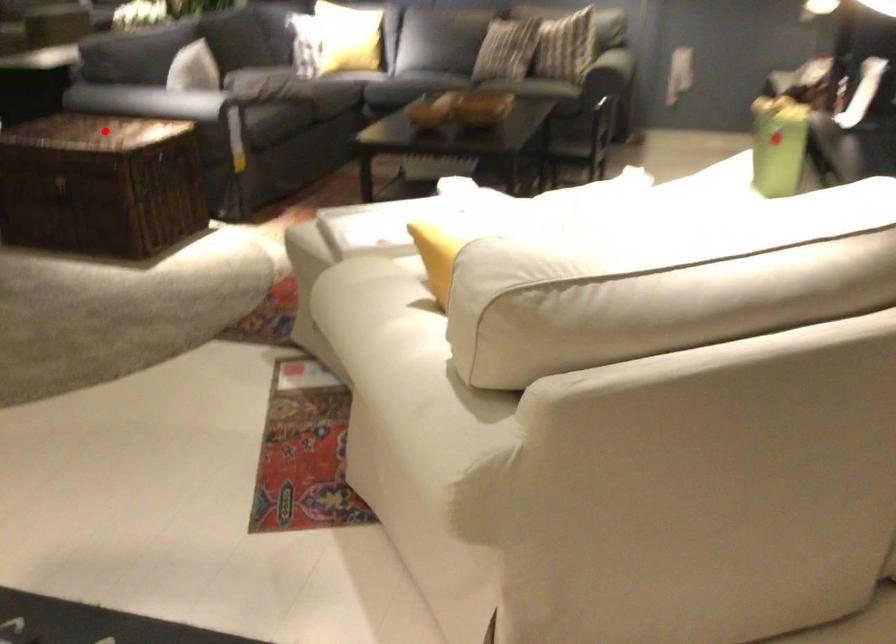
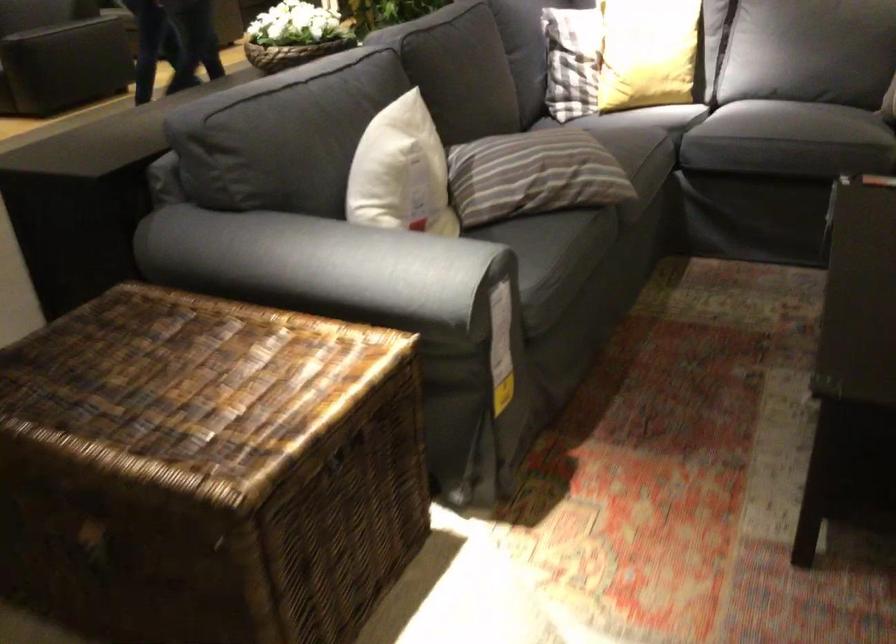
Question: I am providing you with two images of the same scene from different viewpoints. Image1 has a red point marked. In image2, the corresponding 3D location appears at what relative position? Reply with the corresponding letter.

Choices:
 (A) Closer
 (B) Farther

Answer: (A)